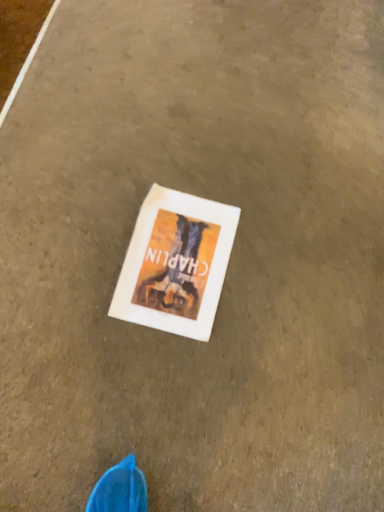
You are a GUI agent. You are given a task and a screenshot of the screen. Output one action in this format:
    pyautogui.click(x=<x>, y=<y>)
    Task: Click on the white paper book at center
    The height and width of the screenshot is (512, 384).
    Given the screenshot: What is the action you would take?
    pyautogui.click(x=176, y=263)

What do you see at coordinates (176, 263) in the screenshot? I see `white paper book at center` at bounding box center [176, 263].

Locate an element on the screen. Image resolution: width=384 pixels, height=512 pixels. white paper book at center is located at coordinates (176, 263).